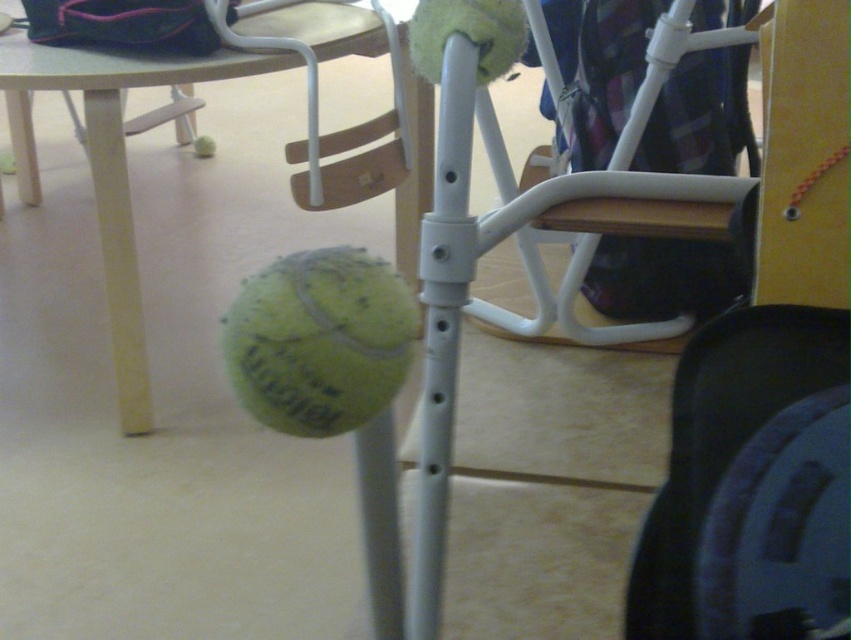
Question: Is white plastic chair at center above green matte tennis ball at center?

Choices:
 (A) yes
 (B) no

Answer: (B)

Question: Which is farther from the yellow rubber tennis ball at center?

Choices:
 (A) white plastic chair at center
 (B) green matte tennis ball at center
 (C) matte white table at center
 (D) yellow matte tennis ball at lower center

Answer: (D)

Question: Considering the real-world distances, which object is farthest from the matte white table at center?

Choices:
 (A) white plastic chair at center
 (B) yellow rubber tennis ball at center

Answer: (B)

Question: Is matte white table at center wider than yellow matte tennis ball at lower center?

Choices:
 (A) no
 (B) yes

Answer: (B)

Question: Among these points, which one is farthest from the camera?

Choices:
 (A) (198, 152)
 (B) (669, 13)
 (C) (488, 74)
 (D) (273, 44)

Answer: (A)

Question: Does white plastic chair at center appear under yellow rubber tennis ball at center?

Choices:
 (A) yes
 (B) no

Answer: (A)